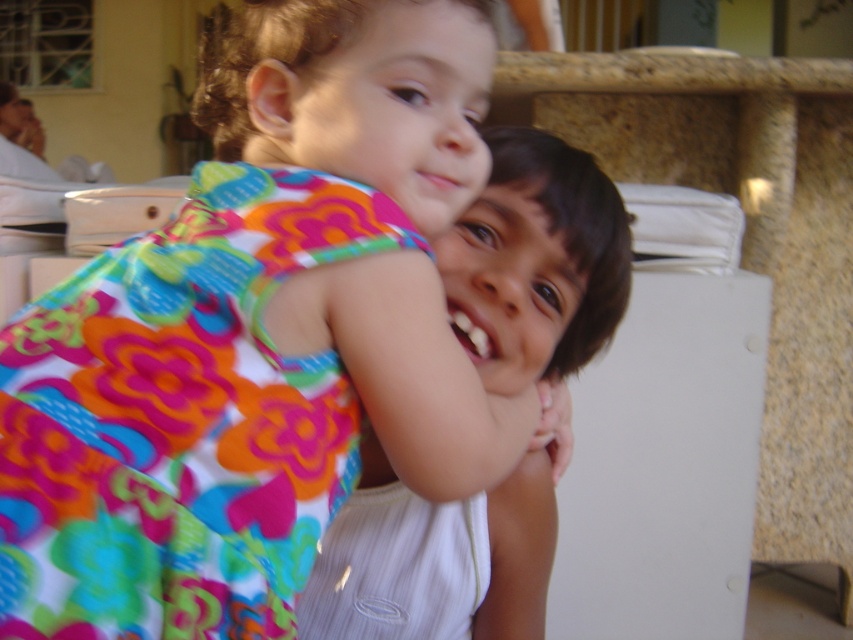
You are a photographer trying to capture the children in the image. You need to adjust your camera focus to ensure both the floral fabric dress at center and the smooth white shirt at center are in focus. Based on their positions, which object should you focus on first to ensure both are sharp?

The floral fabric dress at center is above the smooth white shirt at center, so focusing on the floral fabric dress at center first will help ensure both are in focus since it is closer to the camera.

You are a photographer trying to capture a closeup of the floral fabric dress at center. You notice the smooth white shirt at center is blocking part of the dress. Can you adjust your position to focus on the dress without moving the children?

Yes, since the floral fabric dress at center is closer to the viewer than the smooth white shirt at center, you can move your camera slightly forward or adjust the angle to focus on the dress while the shirt moves out of the frame or becomes less obstructive.

You are a photographer trying to capture the exact position of the floral fabric dress at center in the image. According to the coordinates provided, where would you focus your camera lens to ensure the dress is centered in your shot?

The floral fabric dress at center is located at coordinates point [257,337], so focusing the camera lens there would center it in the shot.